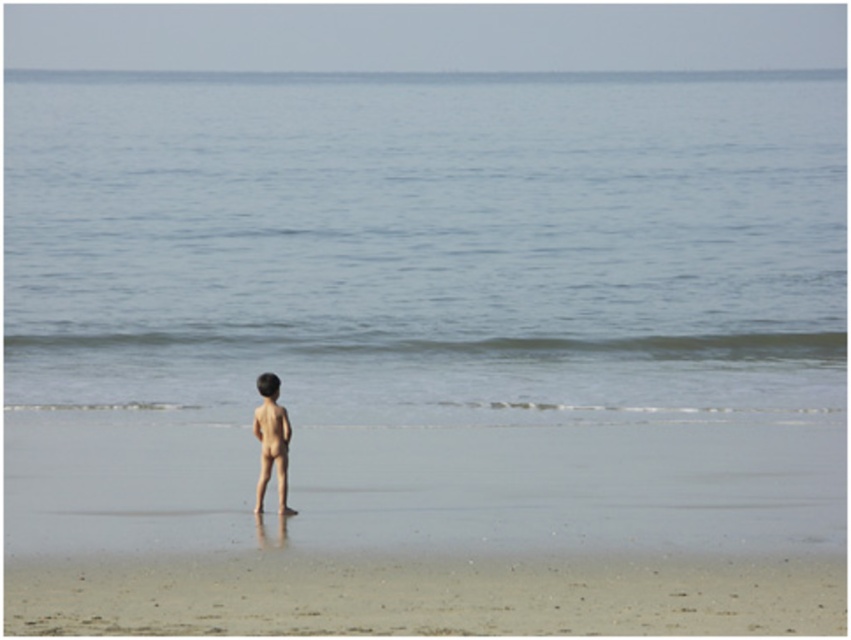
You are a lifeguard on duty at the beach. You notice a point marked at coordinates (426, 241). Based on the scene description, what is the location of this point relative to the child?

The point at coordinates (426, 241) indicates blue water at center. Since the child is standing near the edge of the water facing away from the camera towards the ocean, the blue water at center is located in front of the child.

You are a photographer trying to capture a shot of the smooth skin boy at center and the blue water at center. Which object appears taller in the image?

The blue water at center appears taller than the smooth skin boy at center in the image.